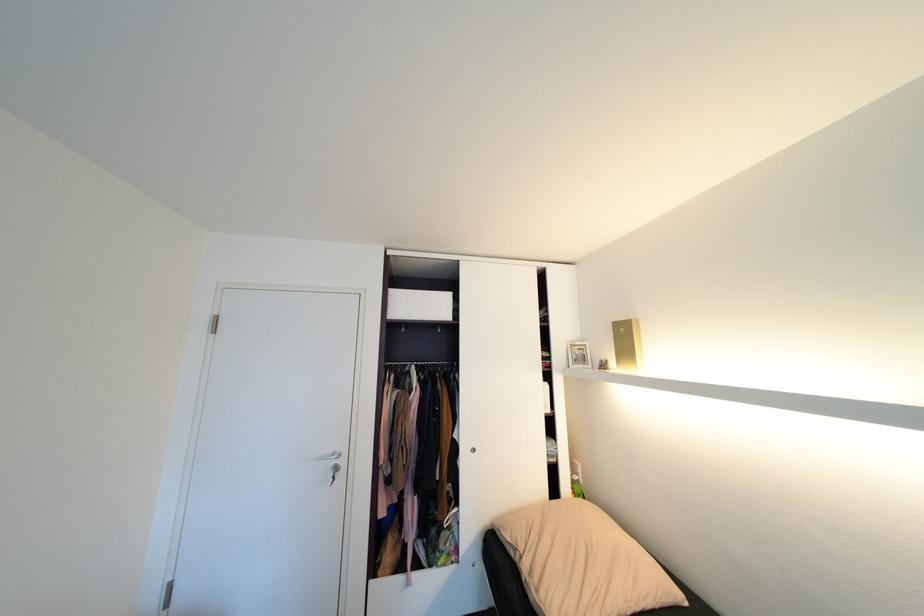
Find where to lift the gold box. Please return your answer as a coordinate pair (x, y).

(627, 345)